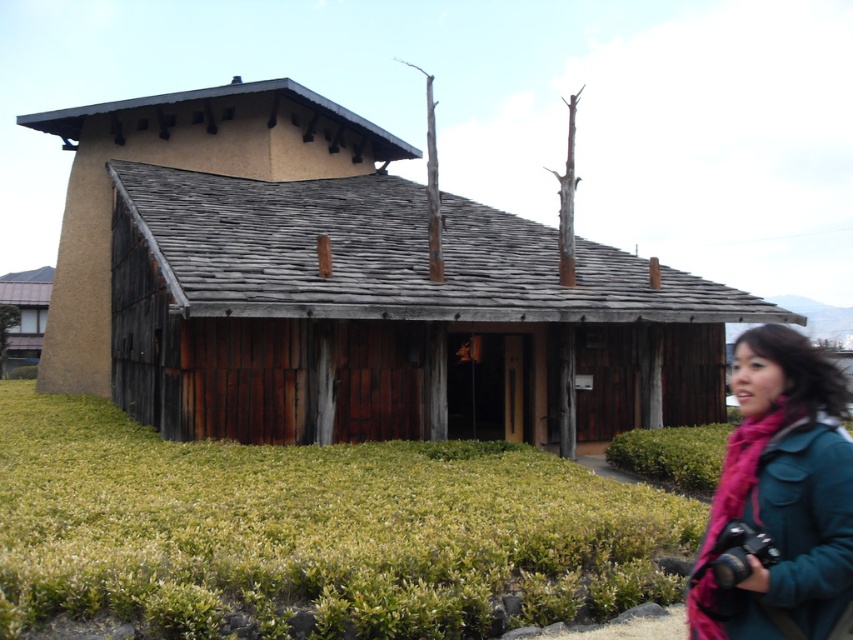
You are a visitor standing in front of the brown wooden hut at center and the teal fabric scarf at lower right. Which object is taller?

The brown wooden hut at center is taller than the teal fabric scarf at lower right.

You are standing in front of the traditional building and see a teal fabric scarf at lower right. What is the exact location of the teal fabric scarf at lower right relative to the point marked as point [780,496]?

The point [780,496] indicates the exact location of the teal fabric scarf at lower right.